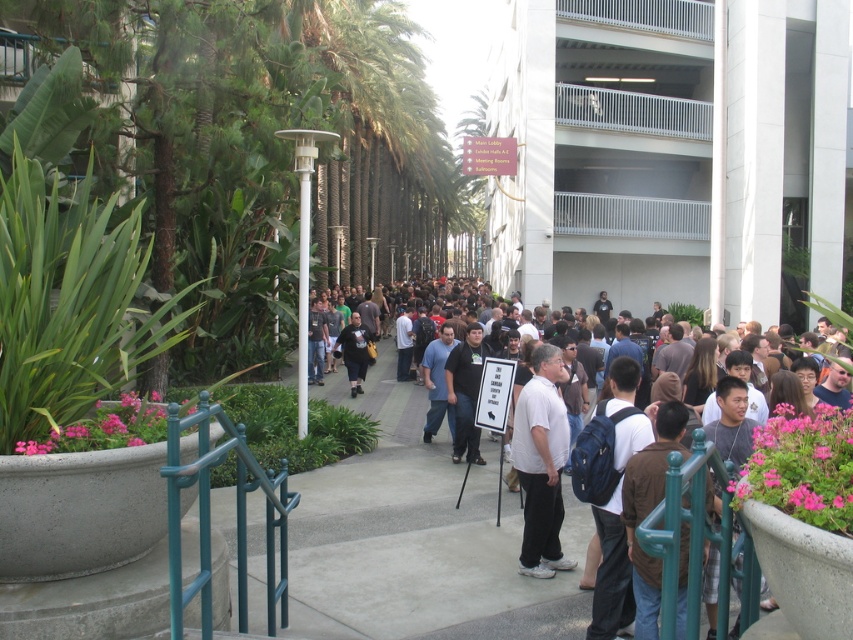
You are standing at the center of the scene and see a dark gray shirt at center. What object is located exactly at the coordinates point (x=421, y=536)?

The dark gray shirt at center is located exactly at point (x=421, y=536).